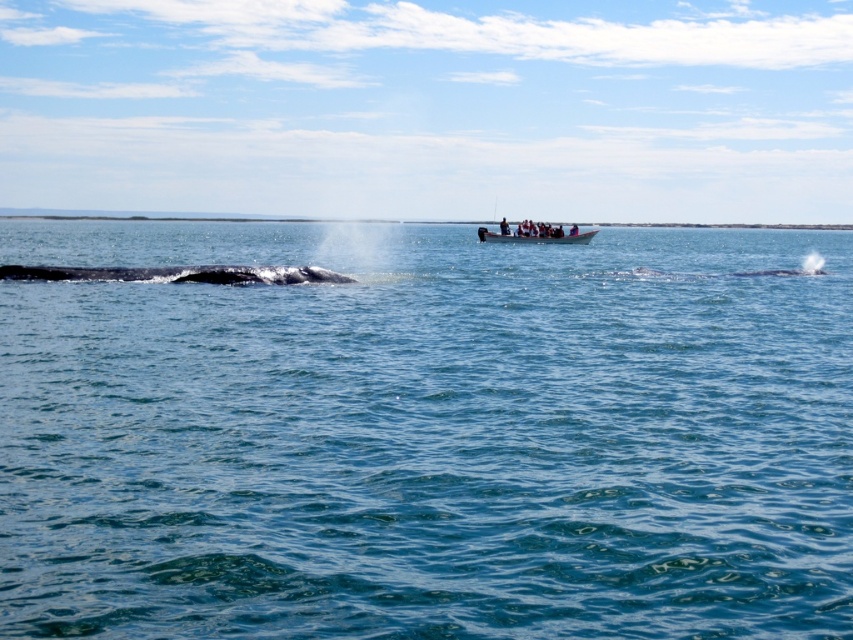
Question: Which point appears farthest from the camera in this image?

Choices:
 (A) (497, 241)
 (B) (189, 269)
 (C) (355, 493)

Answer: (A)

Question: Is the position of clear blue water at center less distant than that of gray matte whale at left?

Choices:
 (A) no
 (B) yes

Answer: (B)

Question: Among these points, which one is nearest to the camera?

Choices:
 (A) (x=78, y=268)
 (B) (x=322, y=244)

Answer: (A)

Question: Which object appears farthest from the camera in this image?

Choices:
 (A) gray matte whale at left
 (B) clear blue water at center
 (C) wooden boat at center

Answer: (C)

Question: Can you confirm if clear blue water at center is positioned to the left of gray matte whale at left?

Choices:
 (A) yes
 (B) no

Answer: (B)

Question: Is clear blue water at center above wooden boat at center?

Choices:
 (A) yes
 (B) no

Answer: (B)